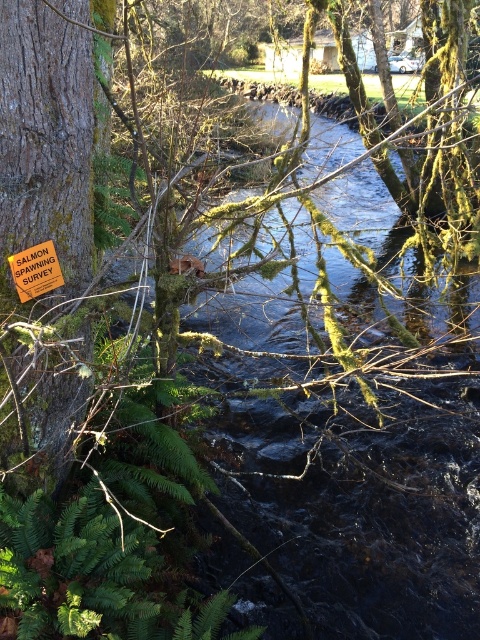
You are a hiker who just arrived at the stream. You see the smooth brown bark at left and the orange plastic sign at left. Which object is taller? Please answer based on the scene.

The smooth brown bark at left is taller than the orange plastic sign at left.

You are a park ranger assessing the width of objects in a conservation area. You observe the smooth brown bark at left and the orange plastic sign at left. Which object has a greater width?

The smooth brown bark at left might be wider than orange plastic sign at left according to the description.